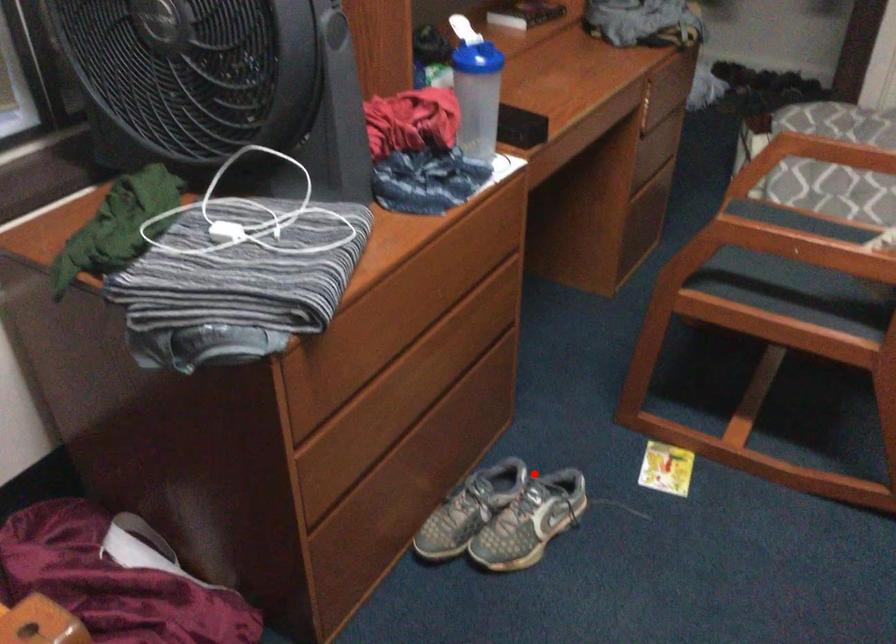
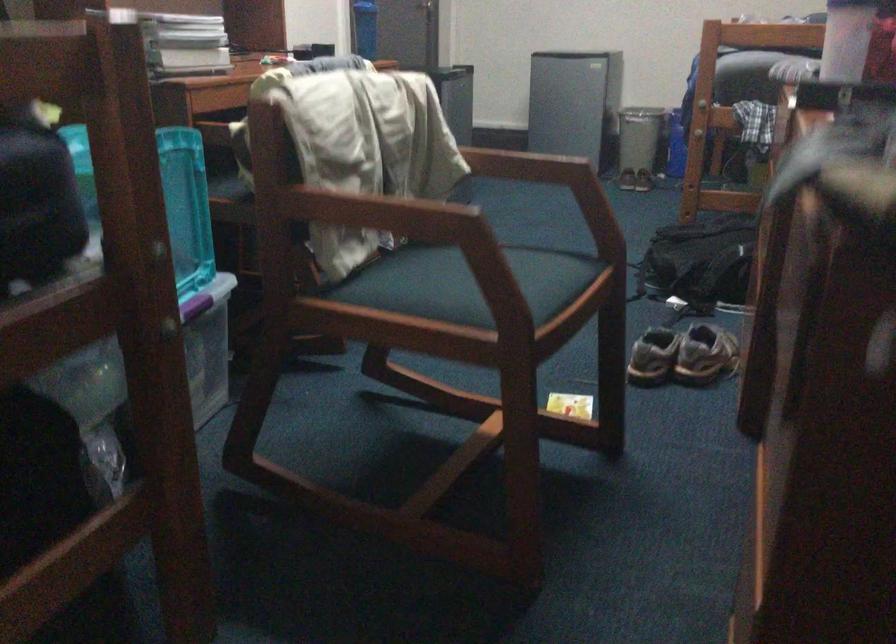
Find the pixel in the second image that matches the highlighted location in the first image.

(682, 355)